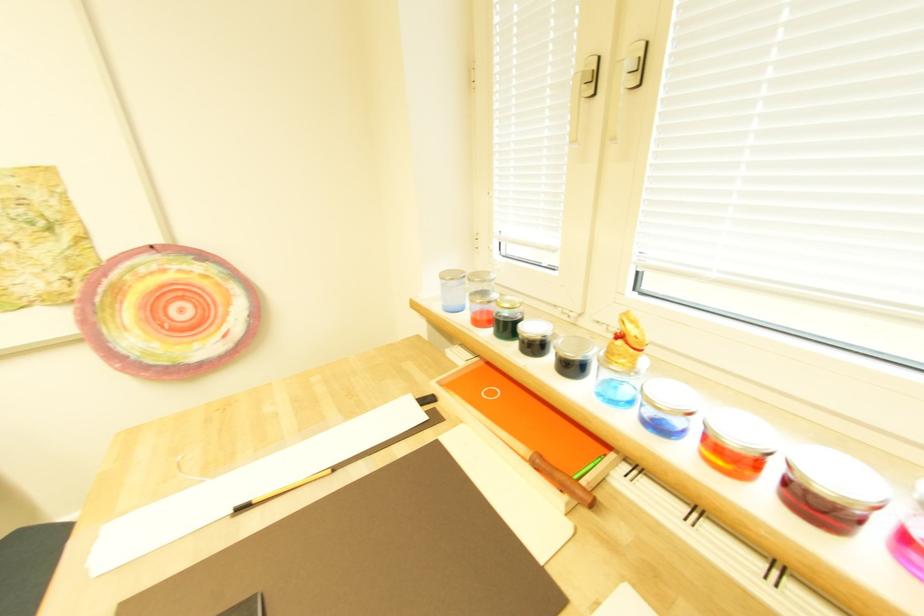
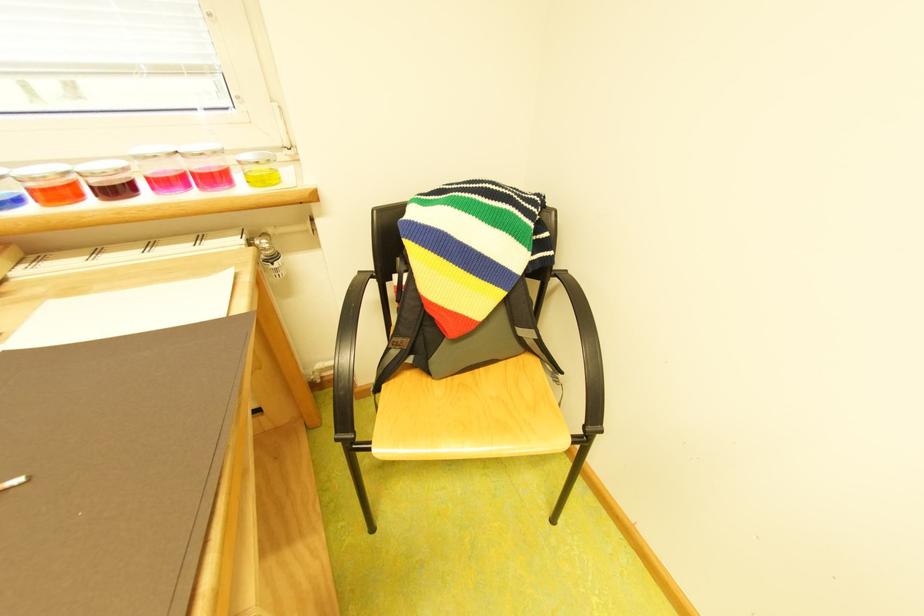
The images are taken continuously from a first-person perspective. In which direction is your viewpoint rotating?

The camera's rotation is toward right-down.